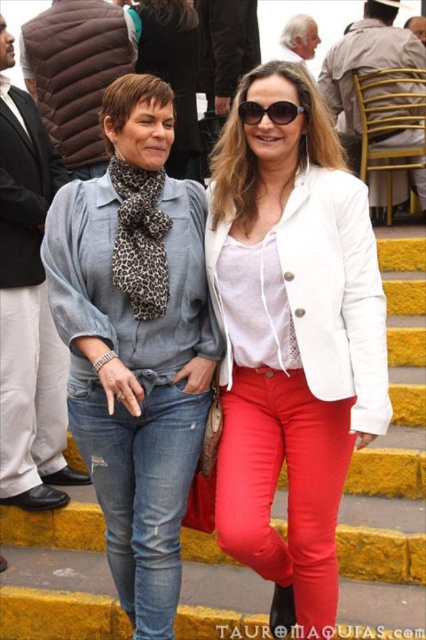
Between point (118, 378) and point (58, 512), which one is positioned behind?

The point (58, 512) is behind.

At what (x,y) coordinates should I click in order to perform the action: click on denim jeans at left. Please return your answer as a coordinate pair (x, y). This screenshot has height=640, width=426. Looking at the image, I should click on (135, 340).

The image size is (426, 640). What do you see at coordinates (291, 339) in the screenshot?
I see `white leather jacket at center` at bounding box center [291, 339].

Image resolution: width=426 pixels, height=640 pixels. I want to click on white leather jacket at center, so click(291, 339).

Is point (273, 344) farther from camera compared to point (222, 621)?

Yes.

I want to click on white leather jacket at center, so click(291, 339).

Which is more to the right, denim jeans at left or ripped denim jeans at center?

ripped denim jeans at center

Which of these two, denim jeans at left or ripped denim jeans at center, stands taller?

denim jeans at left

What do you see at coordinates (135, 340) in the screenshot?
I see `denim jeans at left` at bounding box center [135, 340].

What are the coordinates of `denim jeans at left` in the screenshot? It's located at click(135, 340).